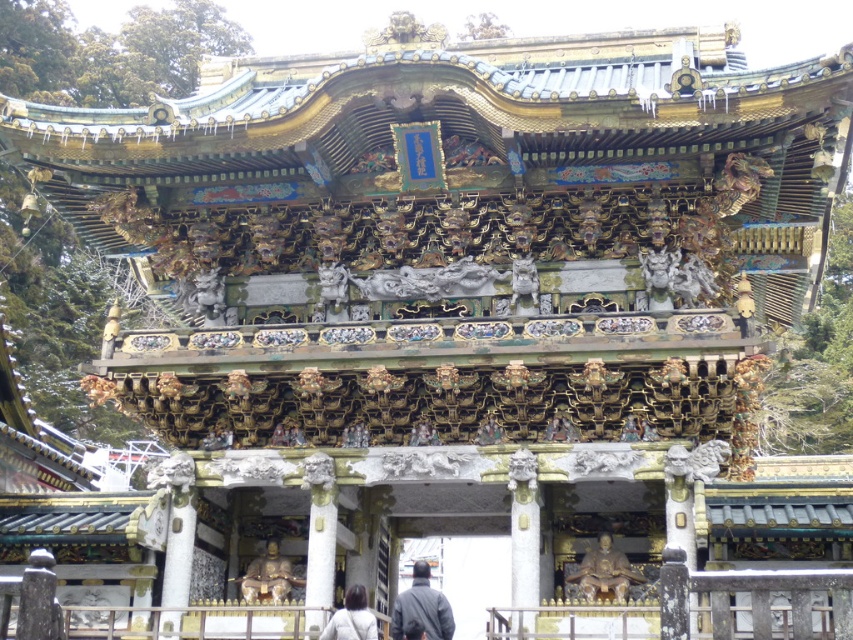
You are standing at the entrance of the temple gate and see two points marked on the pillars. The first point is at coordinates point (619, 596) and the second is at point (424, 604). Which point is closer to you?

Point (424, 604) is closer to you because it is in front of point (619, 596).

Based on the photo, you are standing in front of the torii gate and want to place a 50 meter long banner from your current position to the gold polished statue at center. Is this possible?

The gold polished statue at center is 51.71 meters from viewer, so the 50 meter long banner would be too short to reach it. You need a longer banner.